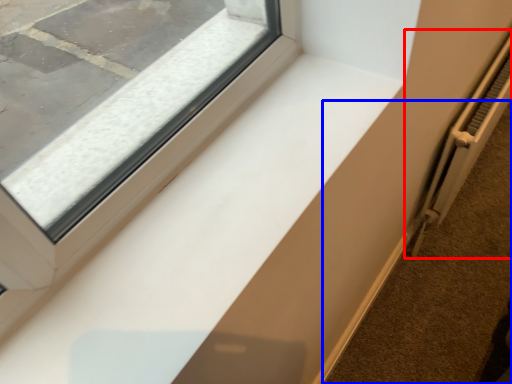
Question: Which object appears farthest to the camera in this image, radiator (highlighted by a red box) or pavement (highlighted by a blue box)?

Choices:
 (A) radiator
 (B) pavement

Answer: (B)